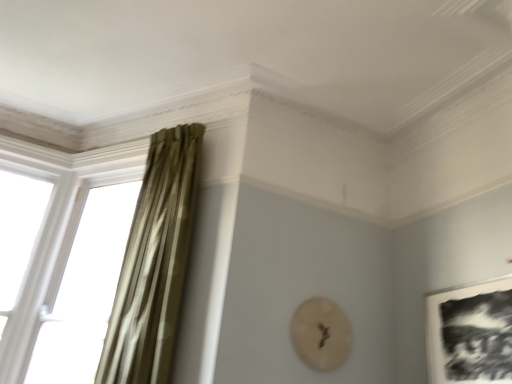
Question: Is green velvet curtain at left next to black matte picture frame at lower right and touching it?

Choices:
 (A) no
 (B) yes

Answer: (A)

Question: Is green velvet curtain at left taller than black matte picture frame at lower right?

Choices:
 (A) no
 (B) yes

Answer: (B)

Question: Is green velvet curtain at left far away from black matte picture frame at lower right?

Choices:
 (A) yes
 (B) no

Answer: (A)

Question: Is the position of green velvet curtain at left less distant than that of black matte picture frame at lower right?

Choices:
 (A) yes
 (B) no

Answer: (B)

Question: From the image's perspective, does green velvet curtain at left appear lower than black matte picture frame at lower right?

Choices:
 (A) yes
 (B) no

Answer: (B)

Question: From the image's perspective, is green velvet curtain at left over black matte picture frame at lower right?

Choices:
 (A) yes
 (B) no

Answer: (A)

Question: From the image's perspective, is black matte picture frame at lower right beneath green velvet curtain at left?

Choices:
 (A) yes
 (B) no

Answer: (A)

Question: Does black matte picture frame at lower right have a greater width compared to green velvet curtain at left?

Choices:
 (A) no
 (B) yes

Answer: (A)

Question: From the image's perspective, is black matte picture frame at lower right over green velvet curtain at left?

Choices:
 (A) no
 (B) yes

Answer: (A)

Question: Is black matte picture frame at lower right oriented away from green velvet curtain at left?

Choices:
 (A) no
 (B) yes

Answer: (A)

Question: Is green velvet curtain at left completely or partially inside black matte picture frame at lower right?

Choices:
 (A) yes
 (B) no

Answer: (B)

Question: From a real-world perspective, is black matte picture frame at lower right positioned over green velvet curtain at left based on gravity?

Choices:
 (A) no
 (B) yes

Answer: (A)

Question: Is translucent glass window at left positioned before black matte picture frame at lower right?

Choices:
 (A) no
 (B) yes

Answer: (A)